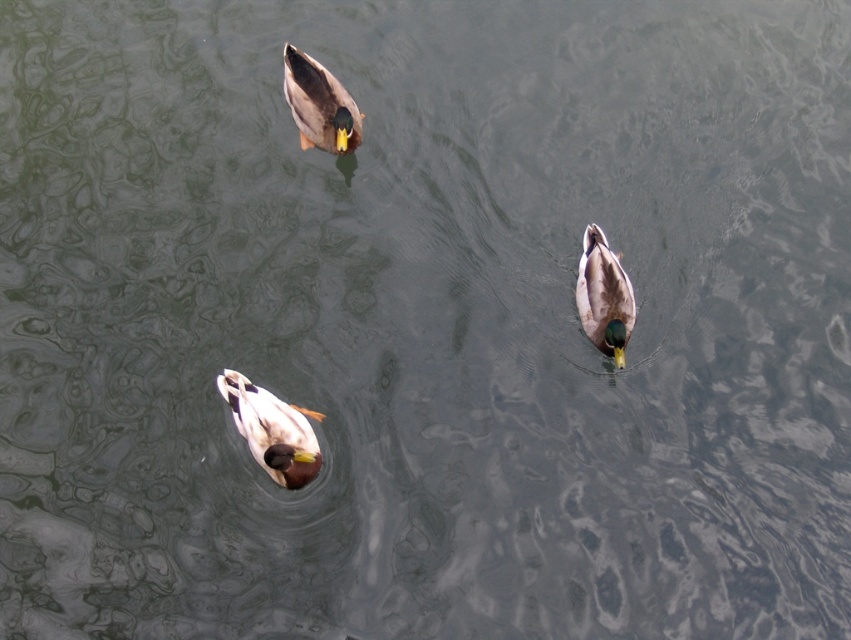
Locate an element on the screen. This screenshot has width=851, height=640. brown glossy duck at upper left is located at coordinates (318, 104).

Does brown glossy duck at upper left appear on the left side of brown matte duck at center?

Indeed, brown glossy duck at upper left is positioned on the left side of brown matte duck at center.

Is point (337, 92) more distant than point (586, 320)?

Yes, point (337, 92) is behind point (586, 320).

The height and width of the screenshot is (640, 851). Identify the location of brown glossy duck at upper left. (318, 104).

Between point (280, 449) and point (318, 108), which one is positioned in front?

Point (280, 449)

Is the position of brown-feathered duck at center less distant than that of brown glossy duck at upper left?

Yes.

Measure the distance between brown-feathered duck at center and camera.

The distance of brown-feathered duck at center from camera is 4.76 meters.

You are a GUI agent. You are given a task and a screenshot of the screen. Output one action in this format:
    pyautogui.click(x=<x>, y=<y>)
    Task: Click on the brown-feathered duck at center
    
    Given the screenshot: What is the action you would take?
    pyautogui.click(x=272, y=429)

Who is more distant from viewer, (271, 410) or (603, 312)?

The point (603, 312) is more distant.

Is point (264, 452) farther from viewer compared to point (581, 314)?

No.

Where is `brown-feathered duck at center`? brown-feathered duck at center is located at coordinates (272, 429).